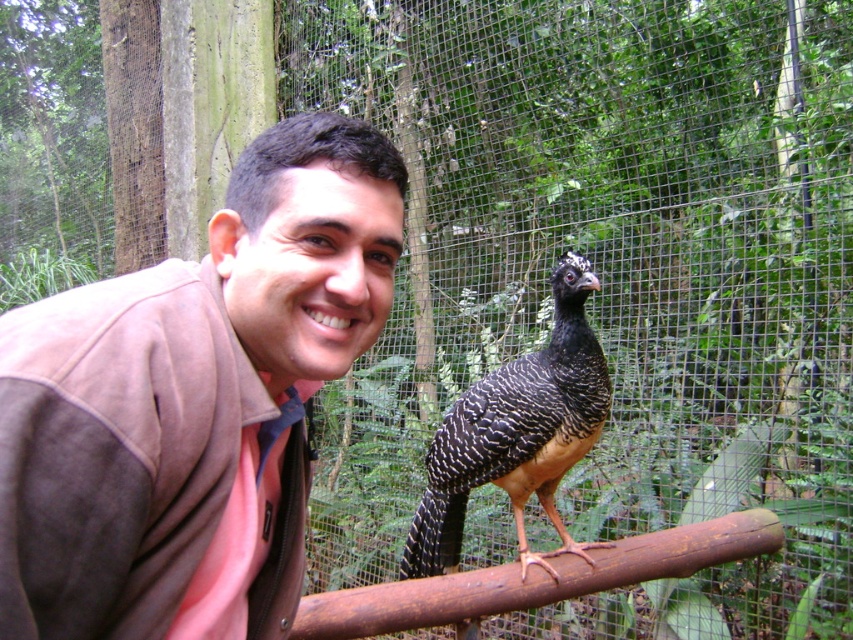
You are standing behind the camera and want to take a photo of the black glossy bird at center. The camera requires you to be at least 5 feet away from the subject to focus properly. Can you take the photo without moving closer than your current position?

The distance between the black glossy bird at center and the camera is 6.80 feet, which is more than the required 5 feet. Therefore, you can take the photo without moving closer.

You are a zookeeper who needs to feed the black glossy bird at center. You have a 12 inch long feeding stick. Can you reach the bird from the rusty metal rail at center without moving the rail?

The distance between the black glossy bird at center and the rusty metal rail at center is 13.39 inches. Since the feeding stick is 12 inches long, it is shorter than the required distance. Therefore, you cannot reach the bird using the feeding stick from the rusty metal rail at center.

What is located at the coordinates point (193, 403) in the image?

The brown suede jacket at upper left is located at point (193, 403).